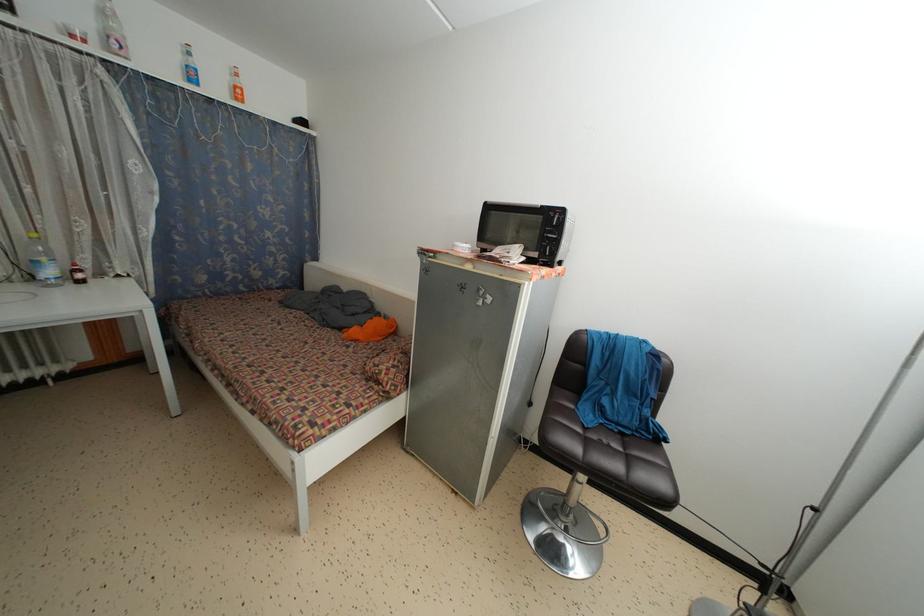
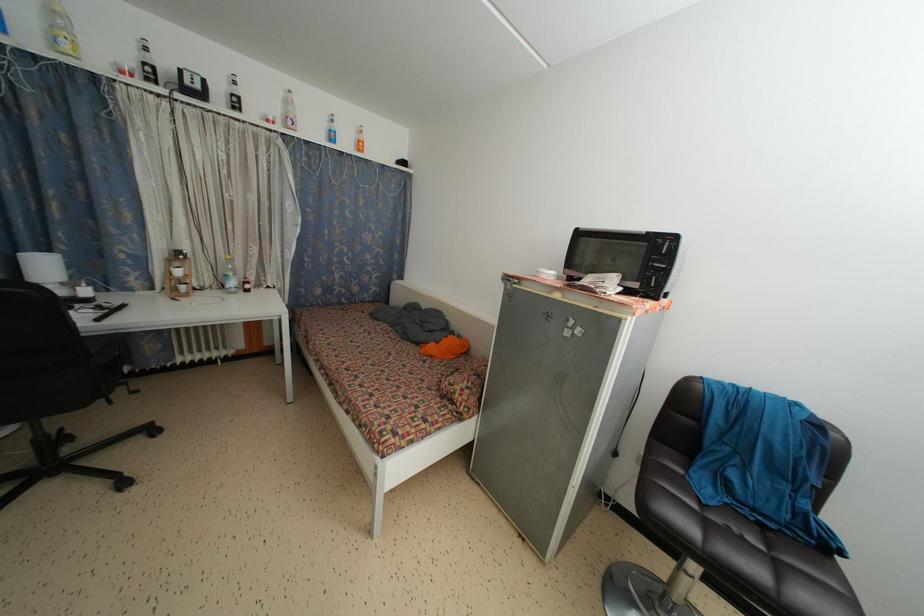
Question: The camera is either moving clockwise (left) or counter-clockwise (right) around the object. The first image is from the beginning of the video and the second image is from the end. Is the camera moving left or right when shooting the video?

Choices:
 (A) Left
 (B) Right

Answer: (B)